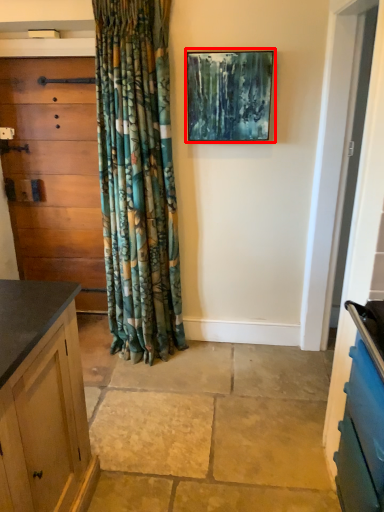
Question: Where is picture frame (annotated by the red box) located in relation to chest of drawers in the image?

Choices:
 (A) right
 (B) left

Answer: (A)